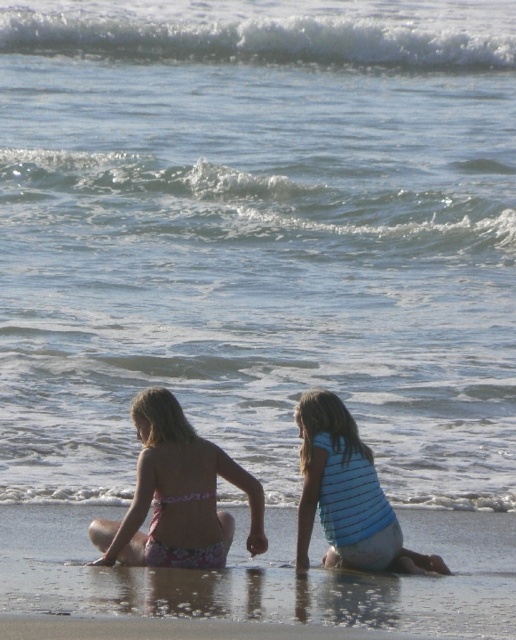
Question: Is smooth sand at lower center to the right of pink floral swimsuit at lower left from the viewer's perspective?

Choices:
 (A) no
 (B) yes

Answer: (B)

Question: Does pink floral swimsuit at lower left come in front of blue striped shirt at lower center?

Choices:
 (A) no
 (B) yes

Answer: (B)

Question: Where is pink floral swimsuit at lower left located in relation to blue striped shirt at lower center in the image?

Choices:
 (A) right
 (B) left

Answer: (B)

Question: Which point is farther to the camera?

Choices:
 (A) (294, 588)
 (B) (112, 541)

Answer: (B)

Question: Which object is the farthest from the pink floral swimsuit at lower left?

Choices:
 (A) smooth sand at lower center
 (B) blue striped shirt at lower center

Answer: (A)

Question: Which point is farther to the camera?

Choices:
 (A) pink floral swimsuit at lower left
 (B) blue striped shirt at lower center
 (C) smooth sand at lower center

Answer: (B)